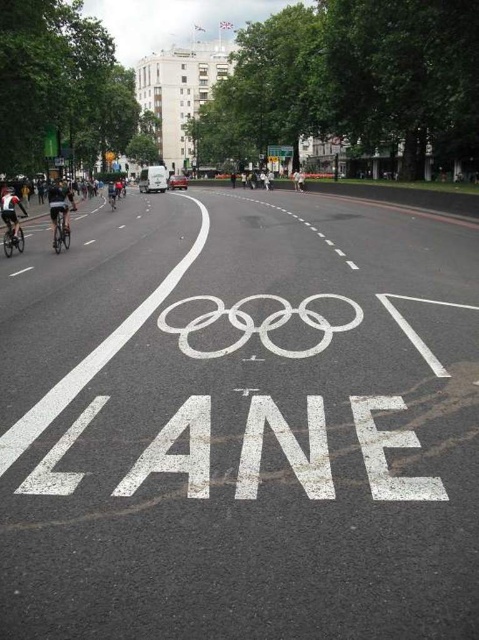
You are a photographer standing at the starting line of the Olympic cycling event. You want to take a photo that includes both the point at coordinates point (x=330, y=378) and point (x=68, y=240). Which point will appear larger in your photo?

Point (x=330, y=378) is closer to the camera than point (x=68, y=240), so it will appear larger in the photo.